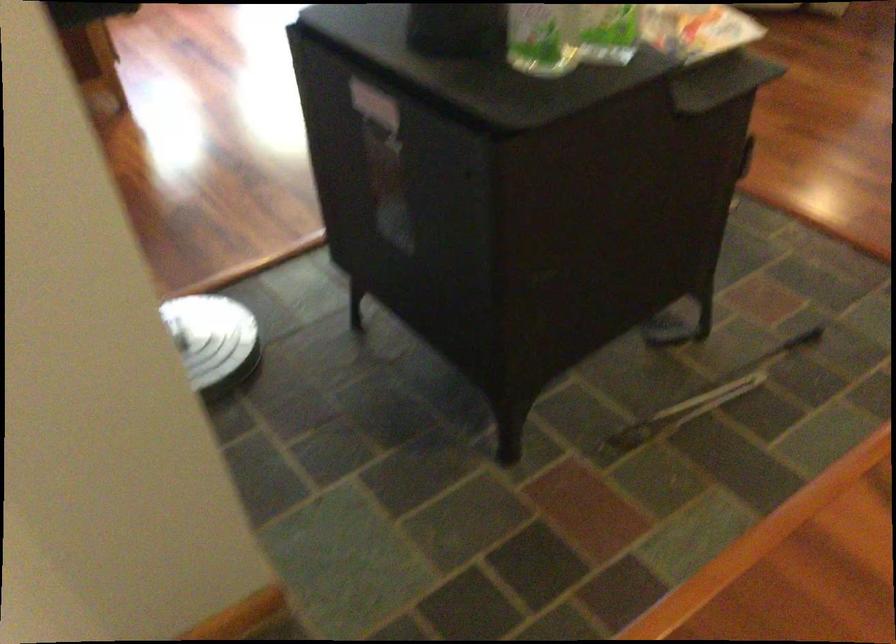
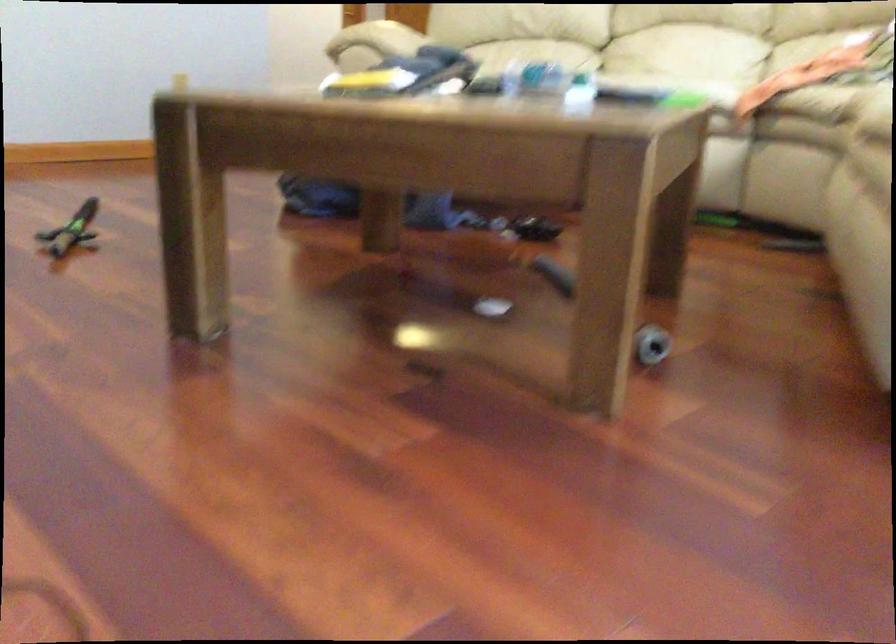
Question: I am providing you with two images of the same scene from different viewpoints. Please identify which objects are invisible in image2.

Choices:
 (A) blue binder handle
 (B) sofa armrest
 (C) robotic vacuum cleaner
 (D) grey cylindrical object

Answer: (C)